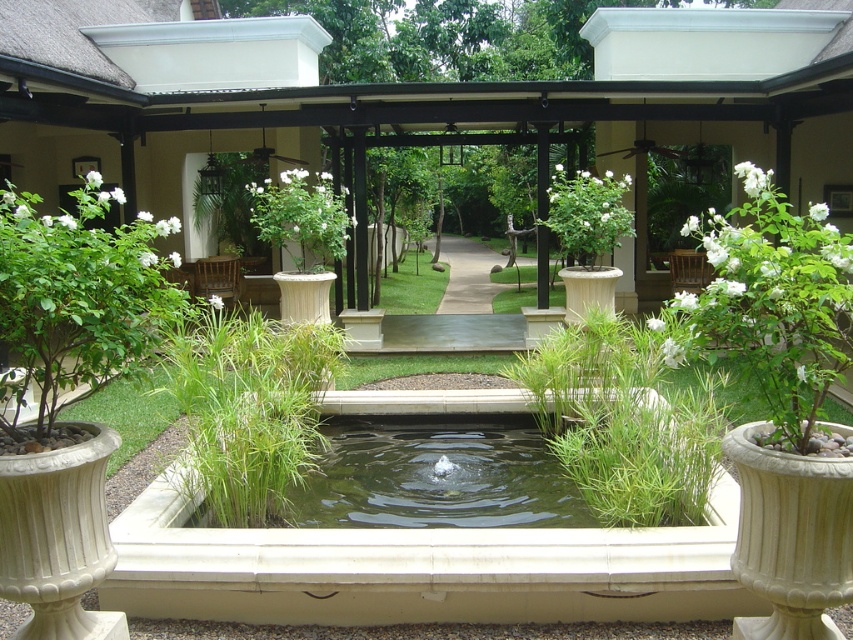
You are a landscape architect designing a pathway between the green grassy pond at center and the white glossy vase at center. If the pathway must be at least 1 meter wide to accommodate visitors, can you fit it between them based on their sizes?

The green grassy pond at center is wider than the white glossy vase at center. Since the pathway requires at least 1 meter of width, you need to ensure that the space between them allows for this width. However, the exact dimensions of the space between them aren

You are a gardener planning to place a new decorative statue in the garden. The statue is 1 meter wide and needs to be placed between the green grass at center and the green grassy plant at center. Is there enough space between them to fit the statue?

The green grass at center is positioned on the right side of green grassy plant at center. The distance between them is not specified, so it is uncertain if the statue will fit. Please check the actual space available.

You are standing in the garden and want to place a new decorative item between the green grassy pond at center and the white glossy vase at center. Based on their positions, which object should you place it closer to?

The green grassy pond at center is to the right of the white glossy vase at center, so placing the new decorative item closer to the white glossy vase at center would position it between them.